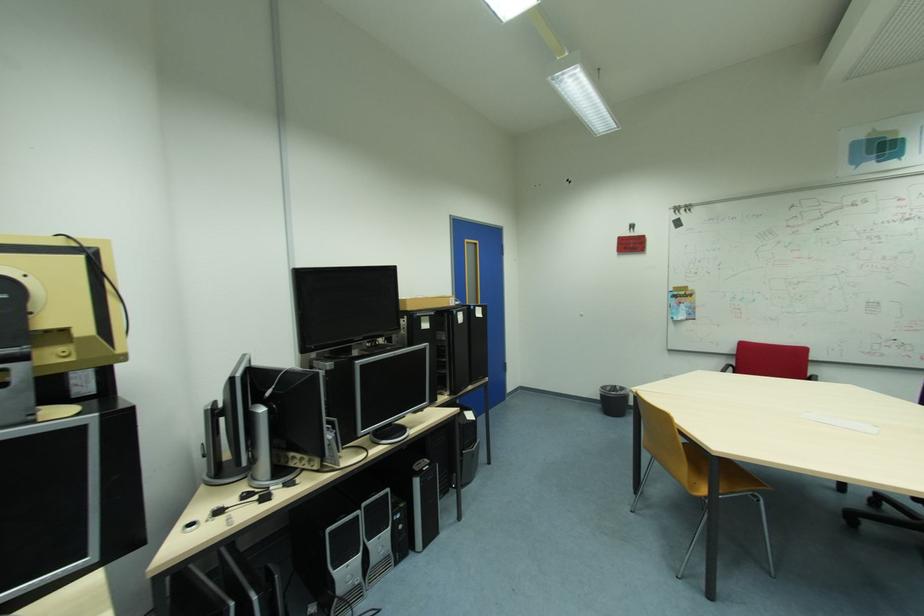
Where is `black chair armrest`? This screenshot has width=924, height=616. black chair armrest is located at coordinates (727, 368).